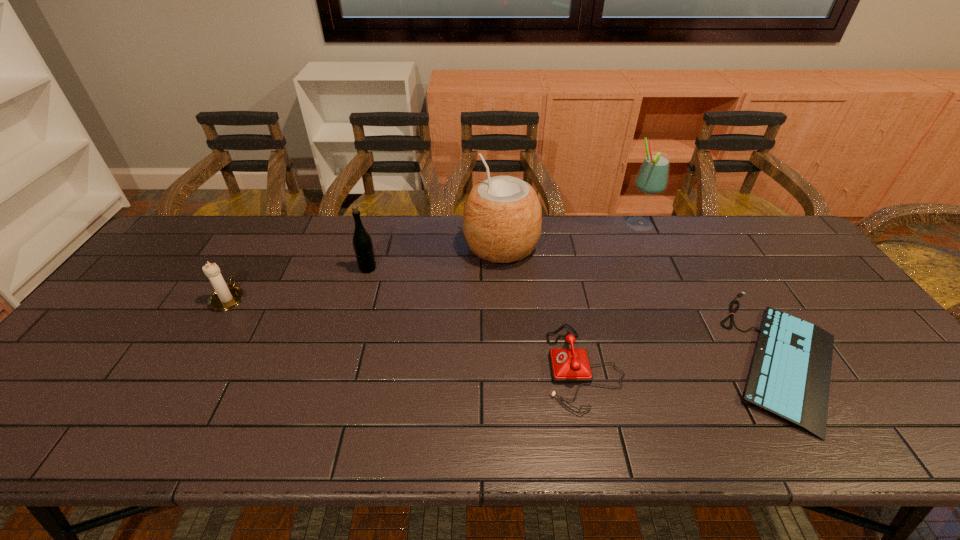
Identify the location of telephone that is at the near edge. (568, 365).

What are the coordinates of `computer keyboard that is at the near edge` in the screenshot? It's located at (789, 378).

The width and height of the screenshot is (960, 540). In order to click on object situated at the right edge in this screenshot , I will do `click(789, 378)`.

Locate an element on the screen. The image size is (960, 540). object that is at the near right corner is located at coordinates (789, 378).

You are a GUI agent. You are given a task and a screenshot of the screen. Output one action in this format:
    pyautogui.click(x=<x>, y=<y>)
    Task: Click on the vacant space at the far edge of the desktop
    
    Given the screenshot: What is the action you would take?
    pyautogui.click(x=324, y=249)

Locate an element on the screen. The width and height of the screenshot is (960, 540). vacant area at the near edge of the desktop is located at coordinates (435, 444).

The width and height of the screenshot is (960, 540). In the image, there is a desktop. What are the coordinates of `vacant space at the right edge` in the screenshot? It's located at (922, 396).

Locate an element on the screen. This screenshot has height=540, width=960. vacant space at the far right corner is located at coordinates (804, 259).

Find the location of a particular element. The image size is (960, 540). free space that is in between the computer keyboard and the coconut is located at coordinates click(642, 301).

Identify the location of vacant area that lies between the telephone and the fifth object from right to left. The width and height of the screenshot is (960, 540). (476, 318).